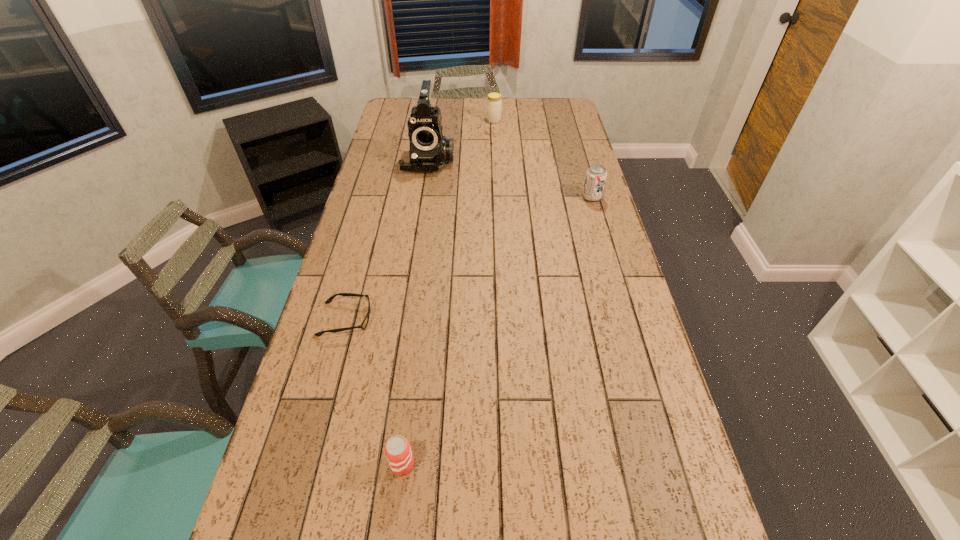
Locate an element on the screen. The image size is (960, 540). vacant point located on the lens mount of the tallest object is located at coordinates (419, 225).

Locate an element on the screen. The width and height of the screenshot is (960, 540). vacant point located 0.360m on the back of the right beer can is located at coordinates coord(576,145).

At what (x,y) coordinates should I click in order to perform the action: click on free space located on the left of the second object from right to left. Please return your answer as a coordinate pair (x, y). This screenshot has width=960, height=540. Looking at the image, I should click on (474, 120).

The height and width of the screenshot is (540, 960). What are the coordinates of `free space located on the right of the nearer beer can` in the screenshot? It's located at (459, 464).

I want to click on vacant space located 0.110m on the front-facing side of the shortest object, so click(409, 319).

Where is `object positioned at the far edge`? This screenshot has width=960, height=540. object positioned at the far edge is located at coordinates (494, 103).

Where is `camcorder situated at the left edge`? camcorder situated at the left edge is located at coordinates (429, 150).

This screenshot has width=960, height=540. I want to click on spectacles present at the left edge, so click(x=364, y=324).

The image size is (960, 540). In order to click on object that is at the right edge in this screenshot , I will do `click(596, 175)`.

This screenshot has width=960, height=540. I want to click on blank space at the far edge of the desktop, so click(528, 104).